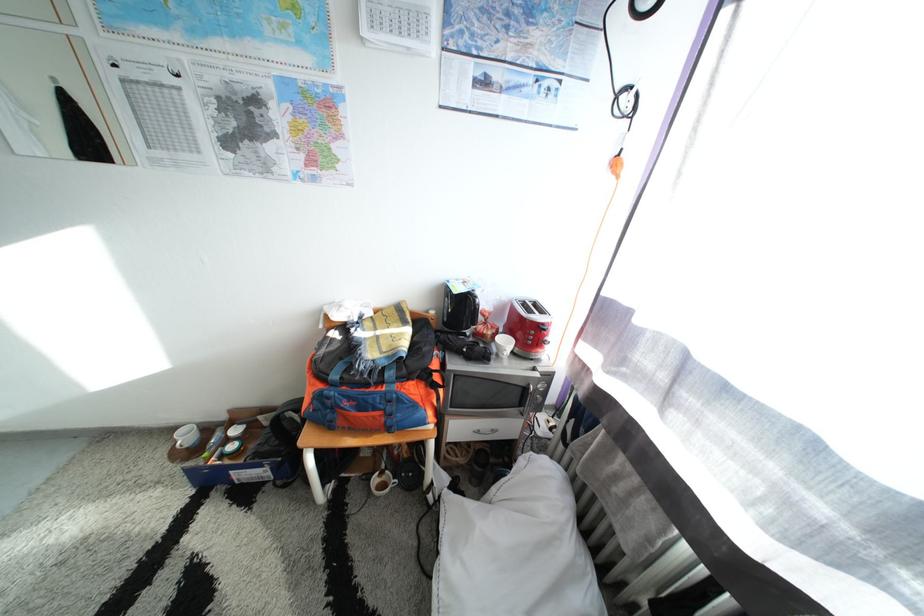
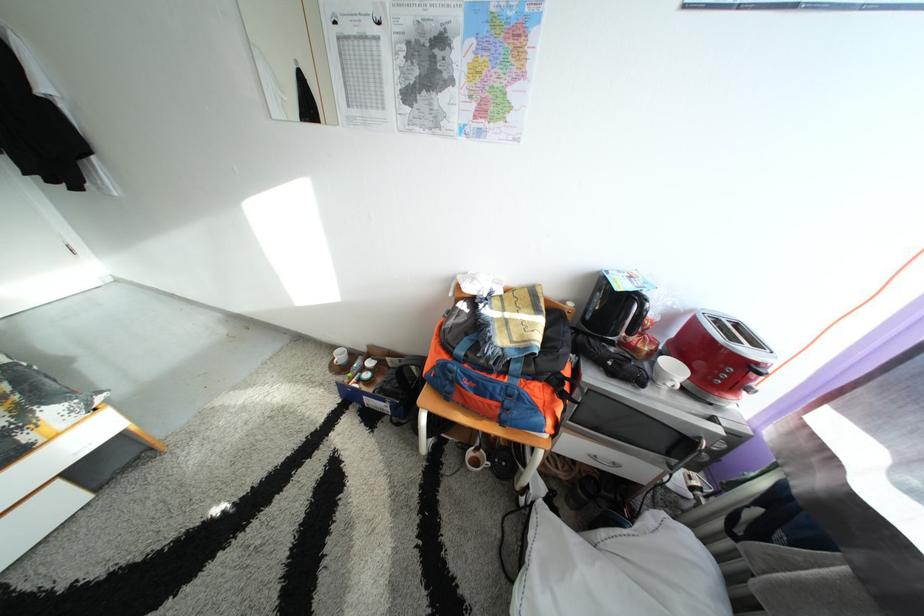
The images are taken continuously from a first-person perspective. In which direction are you moving?

The cameraman moved toward left, forward.